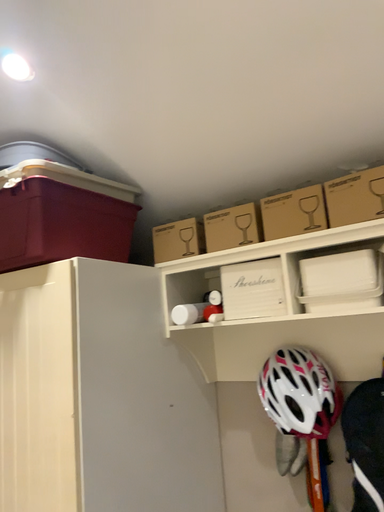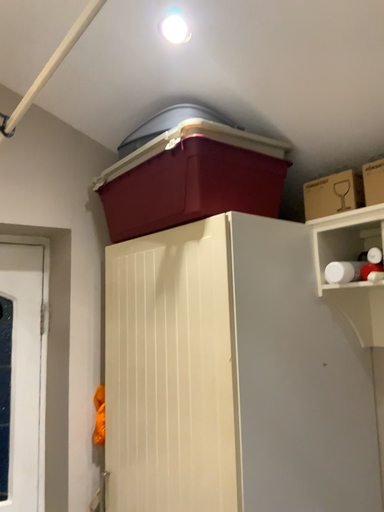
Question: How did the camera likely rotate when shooting the video?

Choices:
 (A) rotated left
 (B) rotated right

Answer: (A)